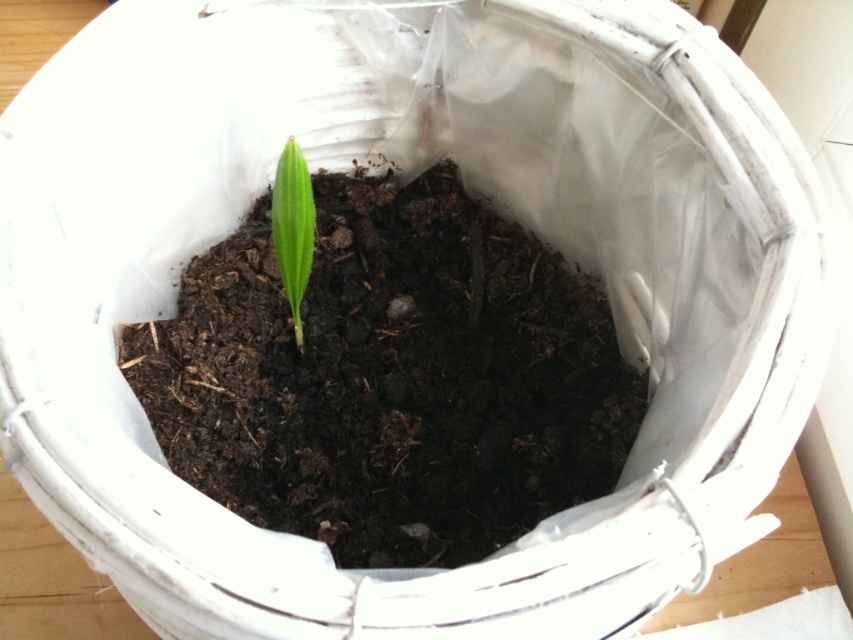
Does dark brown soil at center appear on the left side of green matte leaf at center?

Incorrect, dark brown soil at center is not on the left side of green matte leaf at center.

Is dark brown soil at center further to the viewer compared to green matte leaf at center?

Yes, dark brown soil at center is further from the viewer.

Between point (531, 435) and point (299, 209), which one is positioned behind?

The point (531, 435) is behind.

Locate an element on the screen. Image resolution: width=853 pixels, height=640 pixels. dark brown soil at center is located at coordinates (390, 378).